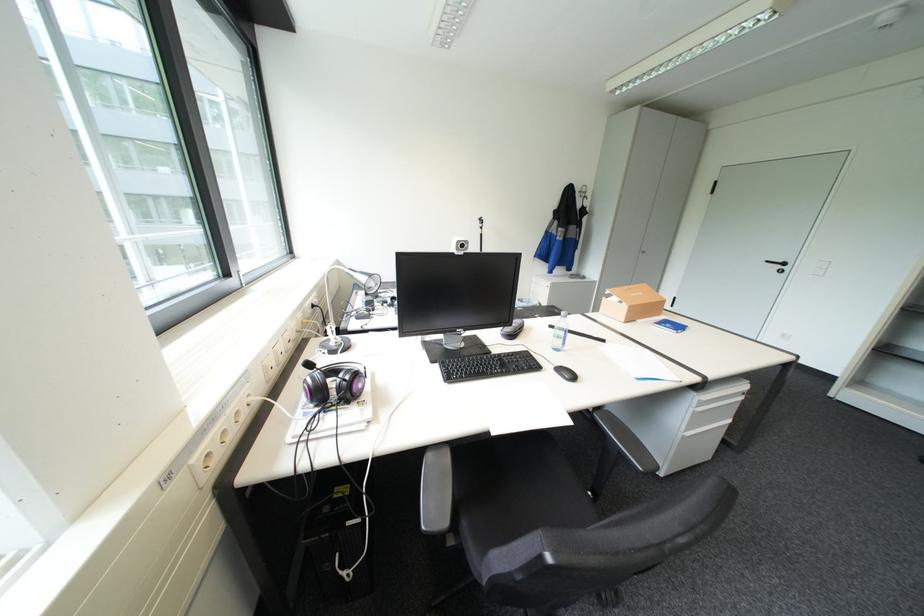
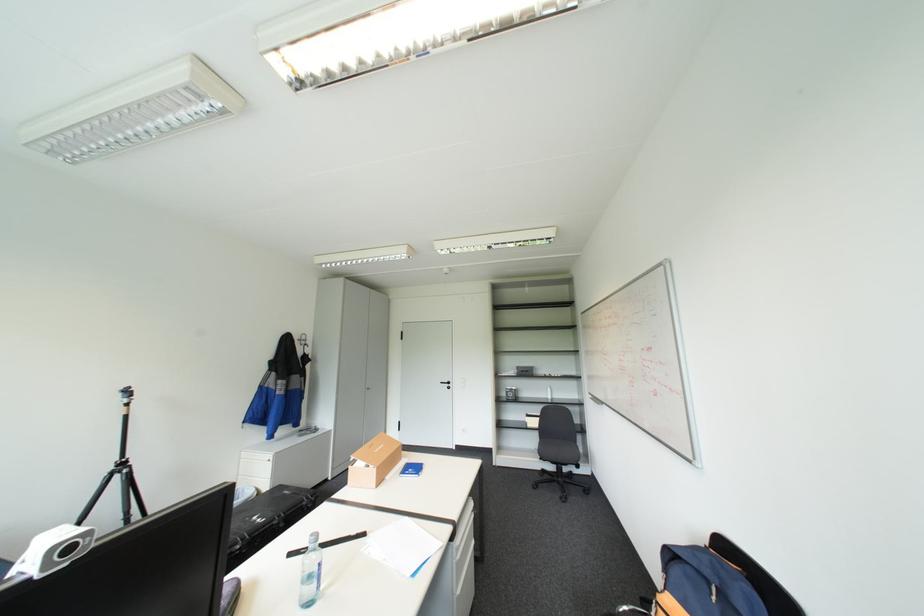
Find the pixel in the second image that matches [538,290] in the first image.

(246, 474)